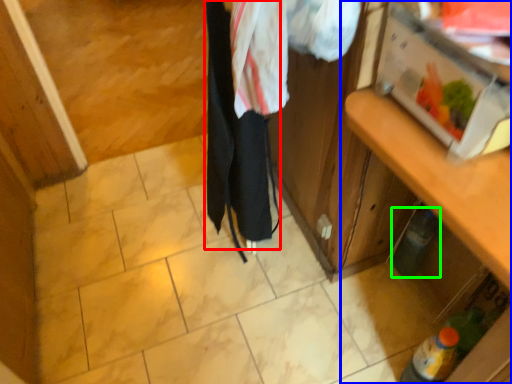
Question: Estimate the real-world distances between objects in this image. Which object is farther from clothing (highlighted by a red box), cabinetry (highlighted by a blue box) or bottle (highlighted by a green box)?

Choices:
 (A) cabinetry
 (B) bottle

Answer: (B)